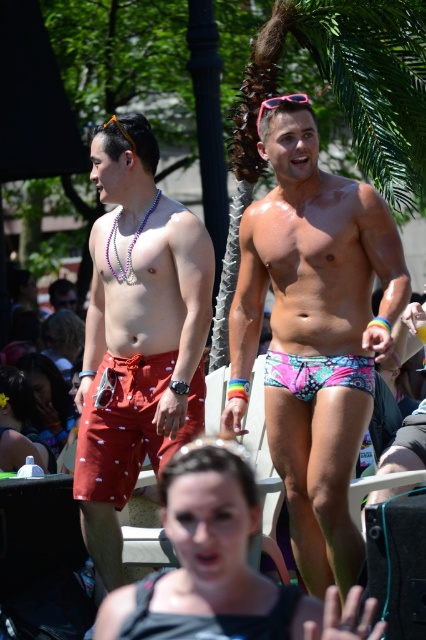
Can you confirm if multicolored printed briefs at center is positioned to the left of matte black hair at lower center?

In fact, multicolored printed briefs at center is to the right of matte black hair at lower center.

Can you confirm if multicolored printed briefs at center is positioned below matte black hair at lower center?

No, multicolored printed briefs at center is not below matte black hair at lower center.

This screenshot has height=640, width=426. I want to click on multicolored printed briefs at center, so click(x=317, y=372).

Between multicolored printed swim trunks at center and matte black hair at lower center, which one has more height?

multicolored printed swim trunks at center is taller.

Does multicolored printed swim trunks at center have a larger size compared to matte black hair at lower center?

Indeed, multicolored printed swim trunks at center has a larger size compared to matte black hair at lower center.

This screenshot has width=426, height=640. Describe the element at coordinates (313, 332) in the screenshot. I see `multicolored printed swim trunks at center` at that location.

The height and width of the screenshot is (640, 426). Find the location of `multicolored printed swim trunks at center`. multicolored printed swim trunks at center is located at coordinates (313, 332).

From the picture: Does green leafy palm tree at upper center have a lesser width compared to matte white bottle at lower left?

No, green leafy palm tree at upper center is not thinner than matte white bottle at lower left.

Locate an element on the screen. Image resolution: width=426 pixels, height=640 pixels. green leafy palm tree at upper center is located at coordinates 339,104.